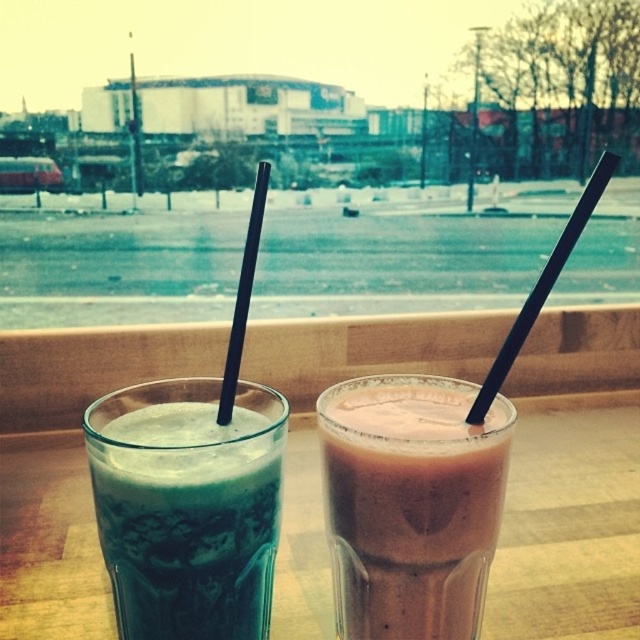
Question: Which of these objects is positioned closest to the wooden table at center?

Choices:
 (A) green frosted glass at left
 (B) black matte straw at center
 (C) chocolate smoothie at center
 (D) black matte straw at right

Answer: (C)

Question: Which of these objects is positioned closest to the green frosted glass at left?

Choices:
 (A) black matte straw at center
 (B) wooden table at center
 (C) chocolate smoothie at center
 (D) black matte straw at right

Answer: (A)

Question: Is green frosted glass at left bigger than black matte straw at right?

Choices:
 (A) yes
 (B) no

Answer: (A)

Question: Does wooden table at center come in front of green frosted glass at left?

Choices:
 (A) no
 (B) yes

Answer: (A)

Question: Does wooden table at center appear on the left side of black matte straw at center?

Choices:
 (A) no
 (B) yes

Answer: (A)

Question: Among these points, which one is farthest from the camera?

Choices:
 (A) [497, 600]
 (B) [256, 214]
 (C) [346, 637]

Answer: (A)